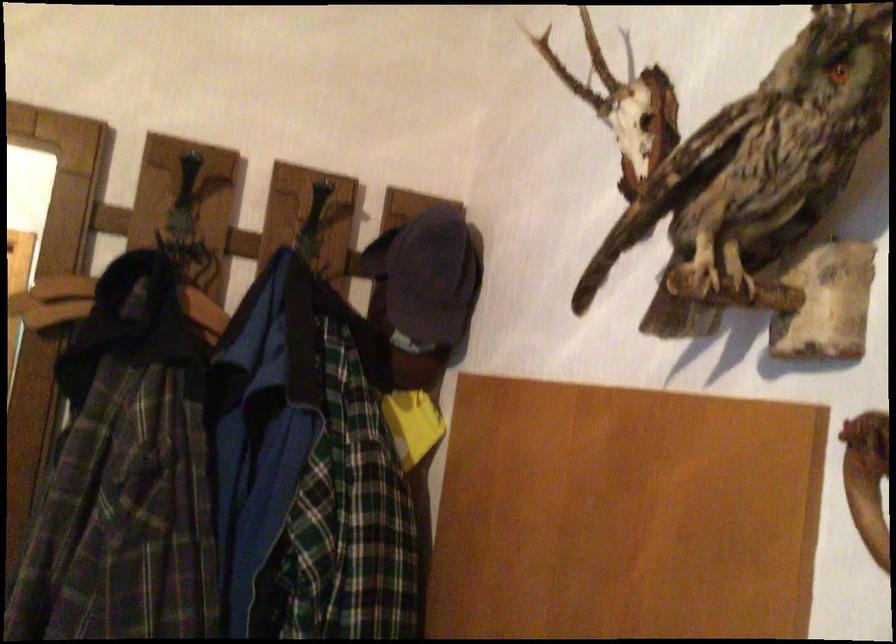
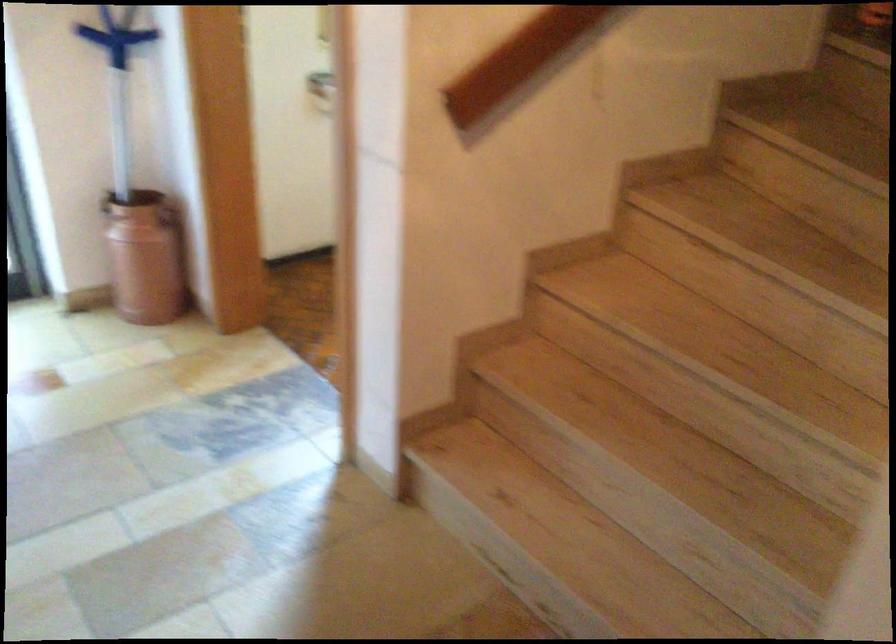
From the picture: How did the camera likely rotate?

The rotation direction of the camera is left-down.